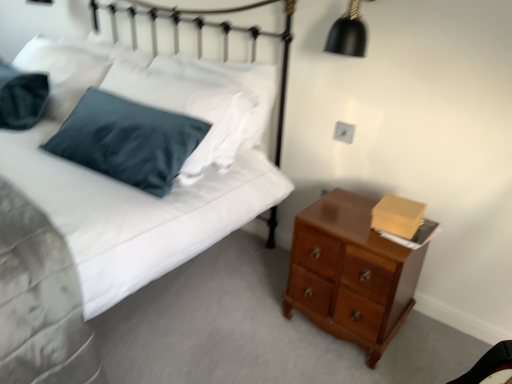
Image resolution: width=512 pixels, height=384 pixels. Find the location of `satin blue pillow at upper left`. satin blue pillow at upper left is located at coordinates (202, 36).

Where is `glossy wood chest of drawers at lower right`? The width and height of the screenshot is (512, 384). glossy wood chest of drawers at lower right is located at coordinates (350, 273).

From their relative heights in the image, would you say satin blue pillow at upper left is taller or shorter than black matte lampshade at upper right?

In the image, satin blue pillow at upper left appears to be taller than black matte lampshade at upper right.

Where is `lamp lying on the right of satin blue pillow at upper left`? The width and height of the screenshot is (512, 384). lamp lying on the right of satin blue pillow at upper left is located at coordinates (348, 33).

Are satin blue pillow at upper left and black matte lampshade at upper right located far from each other?

No.

Based on the photo, is glossy wood chest of drawers at lower right not close to satin blue pillow at upper left?

No, glossy wood chest of drawers at lower right is not far from satin blue pillow at upper left.

From a real-world perspective, who is located higher, glossy wood chest of drawers at lower right or satin blue pillow at upper left?

In real-world perspective, satin blue pillow at upper left is above.

Consider the image. Is the position of black matte lampshade at upper right less distant than that of satin blue pillow at upper left?

Yes, the depth of black matte lampshade at upper right is less than that of satin blue pillow at upper left.

Is black matte lampshade at upper right inside or outside of satin blue pillow at upper left?

black matte lampshade at upper right is not inside satin blue pillow at upper left, it's outside.

From the image's perspective, would you say black matte lampshade at upper right is shown under satin blue pillow at upper left?

No.

Is black matte lampshade at upper right thinner than satin blue pillow at upper left?

Indeed, black matte lampshade at upper right has a lesser width compared to satin blue pillow at upper left.

Based on the photo, does black matte lampshade at upper right have a lesser height compared to glossy wood chest of drawers at lower right?

Yes.

Looking at this image, is black matte lampshade at upper right smaller than glossy wood chest of drawers at lower right?

Correct, black matte lampshade at upper right occupies less space than glossy wood chest of drawers at lower right.

From a real-world perspective, which object stands above the other?

In real-world perspective, black matte lampshade at upper right is above.

Can you confirm if black matte lampshade at upper right is positioned to the left of glossy wood chest of drawers at lower right?

Indeed, black matte lampshade at upper right is positioned on the left side of glossy wood chest of drawers at lower right.

Does satin blue pillow at upper left come behind glossy wood chest of drawers at lower right?

Yes, it is.

From the picture: From the image's perspective, is satin blue pillow at upper left located above or below glossy wood chest of drawers at lower right?

Clearly, from the image's perspective, satin blue pillow at upper left is above glossy wood chest of drawers at lower right.

Is satin blue pillow at upper left taller than glossy wood chest of drawers at lower right?

Yes.

From the picture: Considering the sizes of objects satin blue pillow at upper left and glossy wood chest of drawers at lower right in the image provided, who is wider, satin blue pillow at upper left or glossy wood chest of drawers at lower right?

glossy wood chest of drawers at lower right.

Considering the relative sizes of glossy wood chest of drawers at lower right and black matte lampshade at upper right in the image provided, is glossy wood chest of drawers at lower right smaller than black matte lampshade at upper right?

No, glossy wood chest of drawers at lower right is not smaller than black matte lampshade at upper right.

Which object is closer to the camera, glossy wood chest of drawers at lower right or black matte lampshade at upper right?

glossy wood chest of drawers at lower right is in front.

Can black matte lampshade at upper right be found inside glossy wood chest of drawers at lower right?

No, glossy wood chest of drawers at lower right does not contain black matte lampshade at upper right.

In the image, there is a satin blue pillow at upper left. Where is `lamp above it (from the image's perspective)`? This screenshot has height=384, width=512. lamp above it (from the image's perspective) is located at coordinates (348, 33).

Identify the location of headboard above the glossy wood chest of drawers at lower right (from a real-world perspective). The image size is (512, 384). (202, 36).

Based on their spatial positions, is glossy wood chest of drawers at lower right or black matte lampshade at upper right closer to satin blue pillow at upper left?

black matte lampshade at upper right.

Looking at the image, which one is located further to satin blue pillow at upper left, black matte lampshade at upper right or glossy wood chest of drawers at lower right?

glossy wood chest of drawers at lower right.

Considering their positions, is black matte lampshade at upper right positioned further to glossy wood chest of drawers at lower right than satin blue pillow at upper left?

Among the two, satin blue pillow at upper left is located further to glossy wood chest of drawers at lower right.

Estimate the real-world distances between objects in this image. Which object is closer to black matte lampshade at upper right, glossy wood chest of drawers at lower right or satin blue pillow at upper left?

Based on the image, satin blue pillow at upper left appears to be nearer to black matte lampshade at upper right.

From the image, which object appears to be nearer to glossy wood chest of drawers at lower right, satin blue pillow at upper left or black matte lampshade at upper right?

Among the two, black matte lampshade at upper right is located nearer to glossy wood chest of drawers at lower right.

Which object lies nearer to the anchor point black matte lampshade at upper right, satin blue pillow at upper left or glossy wood chest of drawers at lower right?

satin blue pillow at upper left is positioned closer to the anchor black matte lampshade at upper right.

I want to click on headboard between black matte lampshade at upper right and glossy wood chest of drawers at lower right in the vertical direction, so click(202, 36).